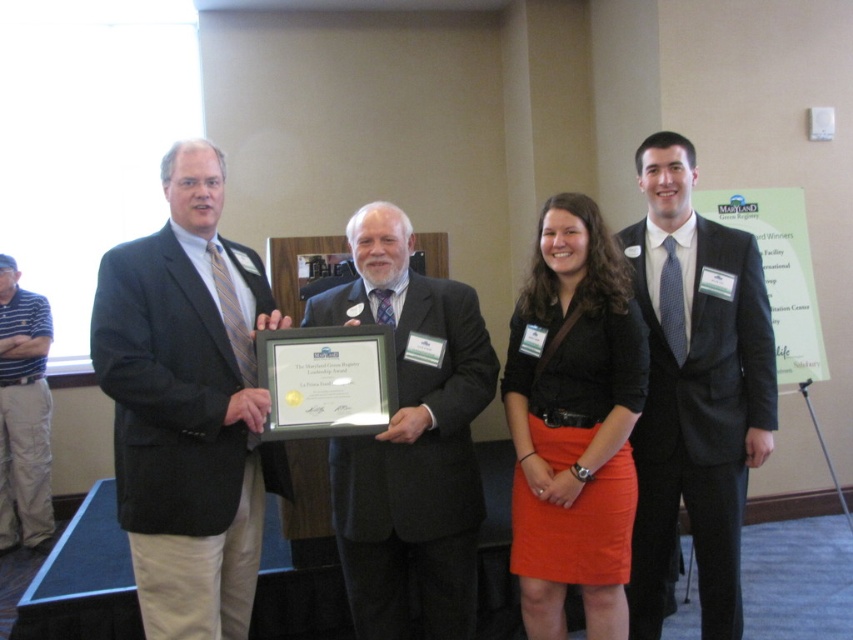
Is dark gray suit at left to the right of orange matte skirt at center from the viewer's perspective?

No, dark gray suit at left is not to the right of orange matte skirt at center.

Which of these two, dark gray suit at left or orange matte skirt at center, stands taller?

With more height is dark gray suit at left.

Who is more forward, (234, 326) or (563, 600)?

Point (234, 326)

Where is `dark gray suit at left`? The width and height of the screenshot is (853, 640). dark gray suit at left is located at coordinates (189, 404).

Measure the distance between dark gray suit at left and camera.

They are 6.06 feet apart.

This screenshot has width=853, height=640. Identify the location of dark gray suit at left. (189, 404).

Describe the element at coordinates (189, 404) in the screenshot. The height and width of the screenshot is (640, 853). I see `dark gray suit at left` at that location.

Image resolution: width=853 pixels, height=640 pixels. What are the coordinates of `dark gray suit at left` in the screenshot? It's located at (189, 404).

Who is shorter, matte black suit at center or striped cotton polo shirt at left?

Standing shorter between the two is matte black suit at center.

Does matte black suit at center come in front of striped cotton polo shirt at left?

Yes, it is in front of striped cotton polo shirt at left.

Is point (415, 378) less distant than point (35, 314)?

That is True.

Locate an element on the screen. The height and width of the screenshot is (640, 853). matte black suit at center is located at coordinates coord(410,444).